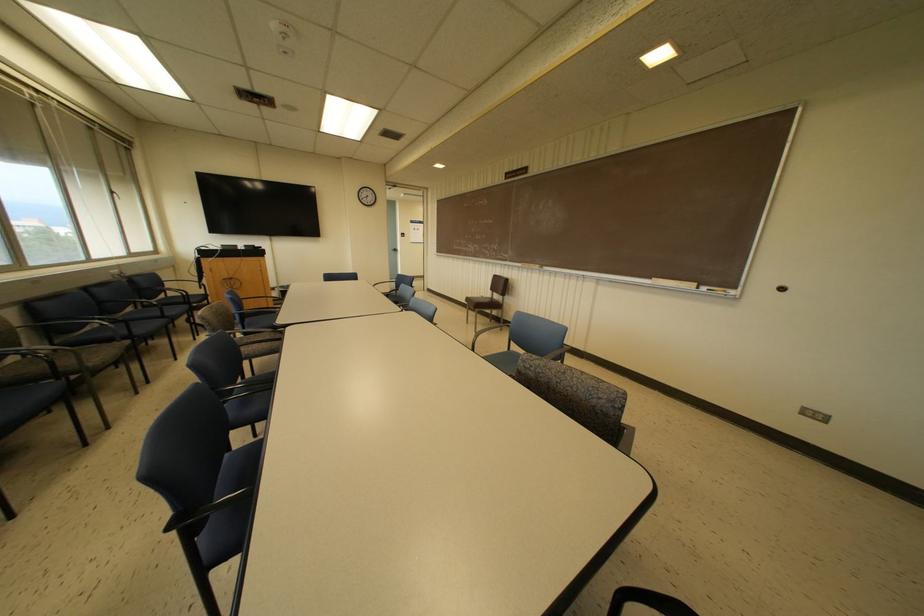
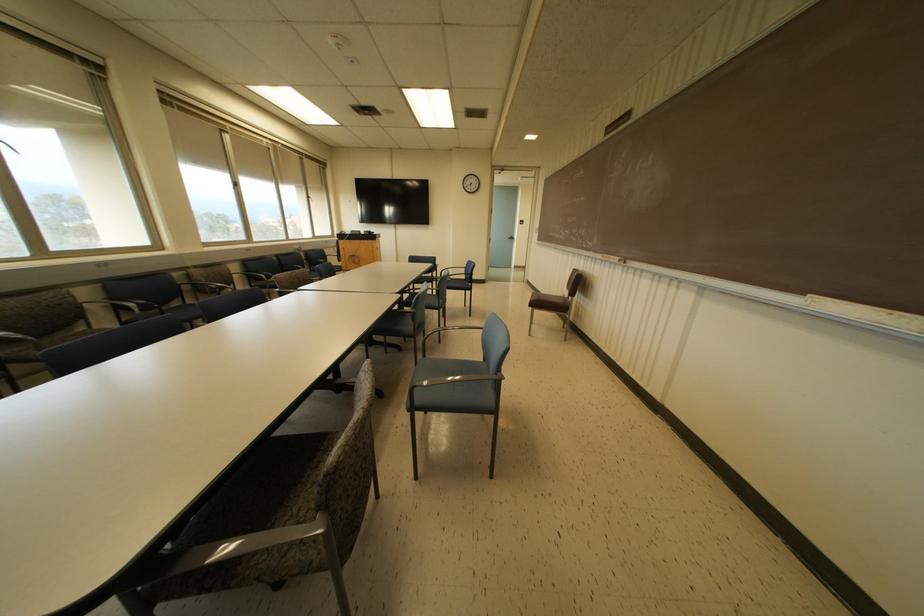
Find the pixel in the second image that matches point (476, 304) in the first image.

(540, 302)